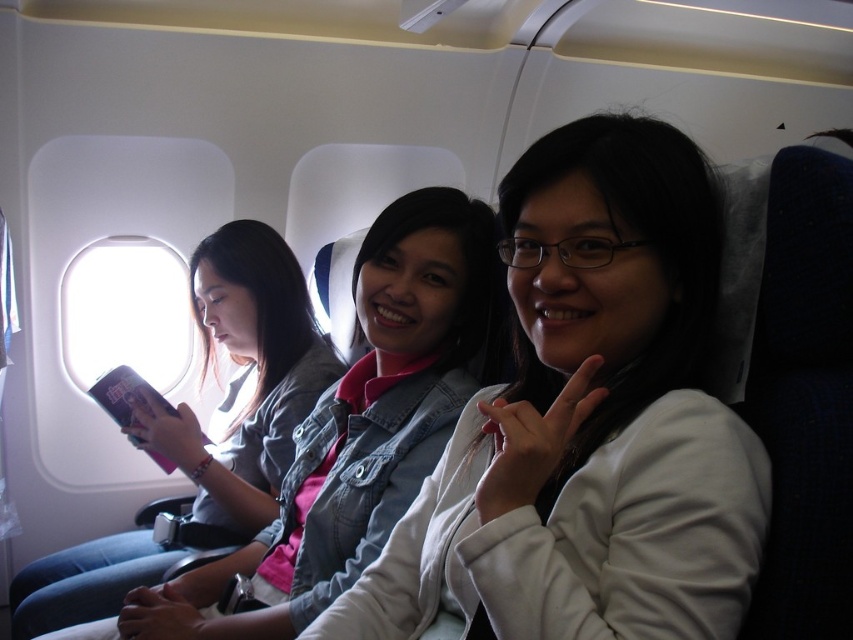
Who is lower down, denim jacket at center or transparent glass airplane window at upper left?

denim jacket at center is below.

Looking at this image, can you confirm if denim jacket at center is positioned to the right of transparent glass airplane window at upper left?

Indeed, denim jacket at center is positioned on the right side of transparent glass airplane window at upper left.

Which is behind, point (419, 456) or point (68, 308)?

Point (68, 308)

Where is `denim jacket at center`? This screenshot has height=640, width=853. denim jacket at center is located at coordinates (355, 429).

Does white matte jacket at center lie behind transparent glass airplane window at upper left?

That is False.

Which is behind, point (672, 579) or point (73, 333)?

Point (73, 333)

At what (x,y) coordinates should I click in order to perform the action: click on white matte jacket at center. Please return your answer as a coordinate pair (x, y). The width and height of the screenshot is (853, 640). Looking at the image, I should click on (587, 422).

In the scene shown: Is white matte jacket at center shorter than denim jacket at center?

Yes.

Is point (693, 416) farther from camera compared to point (212, 573)?

No, (693, 416) is closer to viewer.

Locate an element on the screen. The height and width of the screenshot is (640, 853). white matte jacket at center is located at coordinates (587, 422).